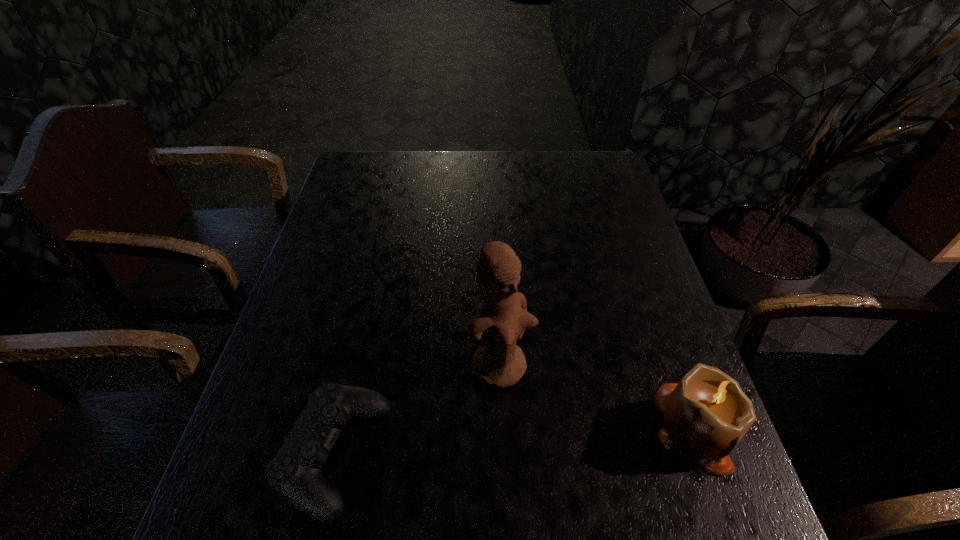
The height and width of the screenshot is (540, 960). In order to click on unoccupied position between the control and the figurine in this screenshot , I will do `click(417, 411)`.

In order to click on free space between the figurine and the second shortest object in this screenshot , I will do `click(417, 411)`.

At what (x,y) coordinates should I click in order to perform the action: click on empty location between the shortest object and the second object from right to left. Please return your answer as a coordinate pair (x, y). Looking at the image, I should click on (431, 319).

Identify the location of empty location between the third tallest object and the rightmost object. (516, 441).

Where is `free space between the candle and the tallest object`? Image resolution: width=960 pixels, height=540 pixels. free space between the candle and the tallest object is located at coordinates (599, 397).

At what (x,y) coordinates should I click in order to perform the action: click on free space between the figurine and the candle. Please return your answer as a coordinate pair (x, y). Image resolution: width=960 pixels, height=540 pixels. Looking at the image, I should click on (599, 397).

Where is `vacant space that is in between the second object from right to left and the third shortest object`? This screenshot has width=960, height=540. vacant space that is in between the second object from right to left and the third shortest object is located at coordinates (599, 397).

Find the location of a particular element. The image size is (960, 540). unoccupied area between the spectacles and the third shortest object is located at coordinates (530, 348).

Where is `object that can be found as the third closest to the farthest object`? object that can be found as the third closest to the farthest object is located at coordinates (706, 414).

Where is `the third closest object relative to the control`? This screenshot has height=540, width=960. the third closest object relative to the control is located at coordinates click(706, 414).